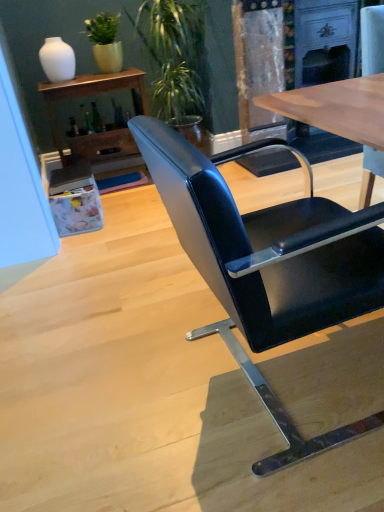
Measure the distance between point (134, 80) and camera.

The depth of point (134, 80) is 8.44 feet.

The image size is (384, 512). Describe the element at coordinates (105, 41) in the screenshot. I see `green matte plant at upper left, placed as the second houseplant when sorted from right to left` at that location.

This screenshot has height=512, width=384. Describe the element at coordinates (57, 60) in the screenshot. I see `white glossy vase at upper left` at that location.

Measure the distance between point (x=46, y=38) and camera.

They are 8.85 feet apart.

Where is `black leather chair at center`? The width and height of the screenshot is (384, 512). black leather chair at center is located at coordinates (269, 264).

What are the coordinates of `matte wood shelf at upper left` in the screenshot? It's located at (91, 95).

Choose the correct answer: Is black leather chair at center inside green matte plant at upper left, the first houseplant positioned from the left, or outside it?

black leather chair at center is outside green matte plant at upper left, the first houseplant positioned from the left.

Could you measure the distance between black leather chair at center and green matte plant at upper left, placed as the second houseplant when sorted from right to left?

black leather chair at center and green matte plant at upper left, placed as the second houseplant when sorted from right to left, are 6.67 feet apart.

Which of these two, black leather chair at center or green matte plant at upper left, the first houseplant positioned from the left, is wider?

Wider between the two is black leather chair at center.

Looking at this image, from the image's perspective, which is above, black leather chair at center or green matte plant at upper left, the first houseplant positioned from the left?

From the image's view, green matte plant at upper left, the first houseplant positioned from the left, is above.

Considering the sizes of objects green matte plant at upper left, placed as the second houseplant when sorted from right to left, and green leafy plant at upper center, the first houseplant positioned from the right, in the image provided, who is smaller, green matte plant at upper left, placed as the second houseplant when sorted from right to left, or green leafy plant at upper center, the first houseplant positioned from the right,?

With smaller size is green matte plant at upper left, placed as the second houseplant when sorted from right to left.

Is green matte plant at upper left, placed as the second houseplant when sorted from right to left, not near green leafy plant at upper center, arranged as the second houseplant when viewed from the left?

No, green matte plant at upper left, placed as the second houseplant when sorted from right to left, is not far from green leafy plant at upper center, arranged as the second houseplant when viewed from the left.

From the image's perspective, which is below, green matte plant at upper left, placed as the second houseplant when sorted from right to left, or green leafy plant at upper center, arranged as the second houseplant when viewed from the left?

green leafy plant at upper center, arranged as the second houseplant when viewed from the left, from the image's perspective.

Between point (84, 33) and point (202, 18), which one is positioned behind?

The point (84, 33) is behind.

Which is less distant, [127,82] or [101,39]?

Positioned in front is point [127,82].

Is matte wood shelf at upper left further to the viewer compared to green matte plant at upper left, placed as the second houseplant when sorted from right to left?

No, matte wood shelf at upper left is closer to the camera.

Measure the distance from matte wood shelf at upper left to green matte plant at upper left, placed as the second houseplant when sorted from right to left.

matte wood shelf at upper left and green matte plant at upper left, placed as the second houseplant when sorted from right to left, are 11.37 inches apart.

How different are the orientations of matte wood shelf at upper left and green matte plant at upper left, the first houseplant positioned from the left, in degrees?

The angular difference between matte wood shelf at upper left and green matte plant at upper left, the first houseplant positioned from the left, is 3.36 degrees.

Which of these two, white glossy vase at upper left or green leafy plant at upper center, arranged as the second houseplant when viewed from the left, stands taller?

green leafy plant at upper center, arranged as the second houseplant when viewed from the left, is taller.

Which is in front, point (61, 72) or point (147, 31)?

The point (61, 72) is in front.

Are white glossy vase at upper left and green leafy plant at upper center, the first houseplant positioned from the right, far apart?

No, there isn't a large distance between white glossy vase at upper left and green leafy plant at upper center, the first houseplant positioned from the right.

Is white glossy vase at upper left not inside green leafy plant at upper center, the first houseplant positioned from the right?

Yes, white glossy vase at upper left is located beyond the bounds of green leafy plant at upper center, the first houseplant positioned from the right.

Based on the photo, considering the sizes of green matte plant at upper left, the first houseplant positioned from the left, and black leather chair at center in the image, is green matte plant at upper left, the first houseplant positioned from the left, wider or thinner than black leather chair at center?

In the image, green matte plant at upper left, the first houseplant positioned from the left, appears to be more narrow than black leather chair at center.

Consider the image. Is green matte plant at upper left, placed as the second houseplant when sorted from right to left, at the right side of black leather chair at center?

In fact, green matte plant at upper left, placed as the second houseplant when sorted from right to left, is to the left of black leather chair at center.

Is green matte plant at upper left, the first houseplant positioned from the left, in front of or behind black leather chair at center in the image?

Visually, green matte plant at upper left, the first houseplant positioned from the left, is located behind black leather chair at center.

From the image's perspective, is green matte plant at upper left, placed as the second houseplant when sorted from right to left, above black leather chair at center?

Yes, from the image's perspective, green matte plant at upper left, placed as the second houseplant when sorted from right to left, is above black leather chair at center.

Considering the relative positions of black leather chair at center and matte wood shelf at upper left in the image provided, is black leather chair at center to the left of matte wood shelf at upper left from the viewer's perspective?

No.

Between black leather chair at center and matte wood shelf at upper left, which one has more height?

With more height is black leather chair at center.

From a real-world perspective, is black leather chair at center above or below matte wood shelf at upper left?

From a real-world perspective, black leather chair at center is physically above matte wood shelf at upper left.

Identify the location of chair below the matte wood shelf at upper left (from the image's perspective). This screenshot has width=384, height=512. (269, 264).

Which object is positioned more to the right, matte wood shelf at upper left or black leather chair at center?

black leather chair at center.

From a real-world perspective, which is physically above, matte wood shelf at upper left or black leather chair at center?

From a 3D spatial view, black leather chair at center is above.

Which object is thinner, matte wood shelf at upper left or black leather chair at center?

Thinner between the two is matte wood shelf at upper left.

Considering the sizes of objects matte wood shelf at upper left and black leather chair at center in the image provided, who is bigger, matte wood shelf at upper left or black leather chair at center?

With larger size is black leather chair at center.

This screenshot has width=384, height=512. I want to click on houseplant that is the 2nd object above the black leather chair at center (from a real-world perspective), so click(x=105, y=41).

You are a GUI agent. You are given a task and a screenshot of the screen. Output one action in this format:
    pyautogui.click(x=<x>, y=<y>)
    Task: Click on the houseplant behind the green leafy plant at upper center, arranged as the second houseplant when viewed from the left
    
    Given the screenshot: What is the action you would take?
    pyautogui.click(x=105, y=41)

Estimate the real-world distances between objects in this image. Which object is further from black leather chair at center, green leafy plant at upper center, the first houseplant positioned from the right, or green matte plant at upper left, the first houseplant positioned from the left?

green matte plant at upper left, the first houseplant positioned from the left, is further to black leather chair at center.

Based on their spatial positions, is green leafy plant at upper center, the first houseplant positioned from the right, or matte wood shelf at upper left closer to black leather chair at center?

green leafy plant at upper center, the first houseplant positioned from the right, lies closer to black leather chair at center than the other object.

In the scene shown: Looking at the image, which one is located closer to green leafy plant at upper center, arranged as the second houseplant when viewed from the left, matte wood shelf at upper left or green matte plant at upper left, placed as the second houseplant when sorted from right to left?

matte wood shelf at upper left.

Considering their positions, is matte wood shelf at upper left positioned further to black leather chair at center than green leafy plant at upper center, arranged as the second houseplant when viewed from the left?

matte wood shelf at upper left is positioned further to the anchor black leather chair at center.

Consider the image. Estimate the real-world distances between objects in this image. Which object is closer to green leafy plant at upper center, arranged as the second houseplant when viewed from the left, white glossy vase at upper left or green matte plant at upper left, placed as the second houseplant when sorted from right to left?

Among the two, green matte plant at upper left, placed as the second houseplant when sorted from right to left, is located nearer to green leafy plant at upper center, arranged as the second houseplant when viewed from the left.

From the image, which object appears to be farther from green matte plant at upper left, placed as the second houseplant when sorted from right to left, black leather chair at center or matte wood shelf at upper left?

Among the two, black leather chair at center is located further to green matte plant at upper left, placed as the second houseplant when sorted from right to left.

Estimate the real-world distances between objects in this image. Which object is further from green matte plant at upper left, placed as the second houseplant when sorted from right to left, green leafy plant at upper center, arranged as the second houseplant when viewed from the left, or black leather chair at center?

Based on the image, black leather chair at center appears to be further to green matte plant at upper left, placed as the second houseplant when sorted from right to left.

Based on their spatial positions, is black leather chair at center or matte wood shelf at upper left closer to green leafy plant at upper center, arranged as the second houseplant when viewed from the left?

The object closer to green leafy plant at upper center, arranged as the second houseplant when viewed from the left, is matte wood shelf at upper left.

Find the location of a particular element. The image size is (384, 512). shelf positioned between black leather chair at center and green matte plant at upper left, placed as the second houseplant when sorted from right to left, from near to far is located at coordinates (91, 95).

What are the coordinates of `houseplant situated between white glossy vase at upper left and green leafy plant at upper center, arranged as the second houseplant when viewed from the left, from left to right` in the screenshot? It's located at (105, 41).

The image size is (384, 512). I want to click on houseplant positioned between black leather chair at center and green matte plant at upper left, the first houseplant positioned from the left, from near to far, so click(x=175, y=63).

You are a GUI agent. You are given a task and a screenshot of the screen. Output one action in this format:
    pyautogui.click(x=<x>, y=<y>)
    Task: Click on the shelf between black leather chair at center and white glossy vase at upper left in the front-back direction
    This screenshot has height=512, width=384.
    Given the screenshot: What is the action you would take?
    pyautogui.click(x=91, y=95)